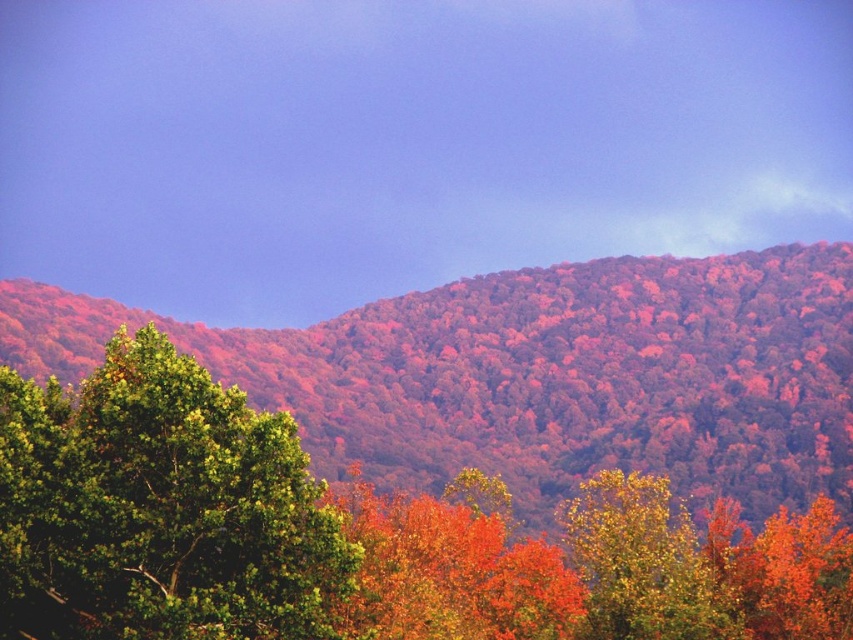
Question: Is green matte tree at lower left below golden yellow leaves at center?

Choices:
 (A) yes
 (B) no

Answer: (B)

Question: Is autumn leaves at center in front of golden yellow leaves at center?

Choices:
 (A) no
 (B) yes

Answer: (A)

Question: Among these objects, which one is nearest to the camera?

Choices:
 (A) green matte tree at lower left
 (B) golden yellow leaves at center

Answer: (A)

Question: Which of the following is the farthest from the observer?

Choices:
 (A) green matte tree at lower left
 (B) golden yellow leaves at center
 (C) autumn leaves at center

Answer: (C)

Question: Does autumn leaves at center appear on the right side of golden yellow leaves at center?

Choices:
 (A) no
 (B) yes

Answer: (A)

Question: Which point is closer to the camera?

Choices:
 (A) (199, 625)
 (B) (711, 276)

Answer: (A)